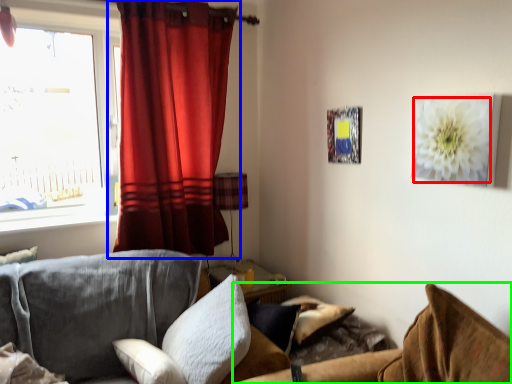
Question: Based on their relative distances, which object is nearer to flower (highlighted by a red box)? Choose from curtain (highlighted by a blue box) and couch (highlighted by a green box).

Choices:
 (A) curtain
 (B) couch

Answer: (B)